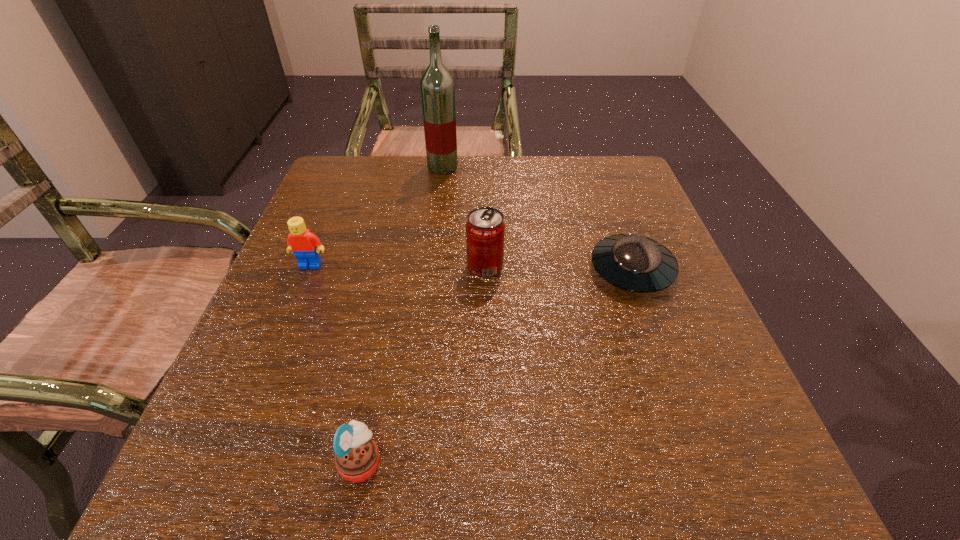
Locate an element on the screen. the farthest object is located at coordinates (437, 86).

At what (x,y) coordinates should I click in order to perform the action: click on the tallest object. Please return your answer as a coordinate pair (x, y). The height and width of the screenshot is (540, 960). Looking at the image, I should click on (437, 86).

Where is `pop soda`? Image resolution: width=960 pixels, height=540 pixels. pop soda is located at coordinates (485, 229).

Identify the location of the leftmost object. (305, 245).

I want to click on the second shortest object, so click(356, 456).

Find the location of a particular element. This screenshot has width=960, height=540. the nearest object is located at coordinates (356, 456).

At what (x,y) coordinates should I click in order to perform the action: click on saucer. Please return your answer as a coordinate pair (x, y). This screenshot has height=540, width=960. Looking at the image, I should click on (635, 263).

Where is `the rightmost object`? This screenshot has width=960, height=540. the rightmost object is located at coordinates (635, 263).

This screenshot has width=960, height=540. In order to click on free region located 0.260m on the front of the liquor in this screenshot , I will do `click(434, 239)`.

Locate an element on the screen. The image size is (960, 540). vacant region located on the left of the pop soda is located at coordinates (368, 267).